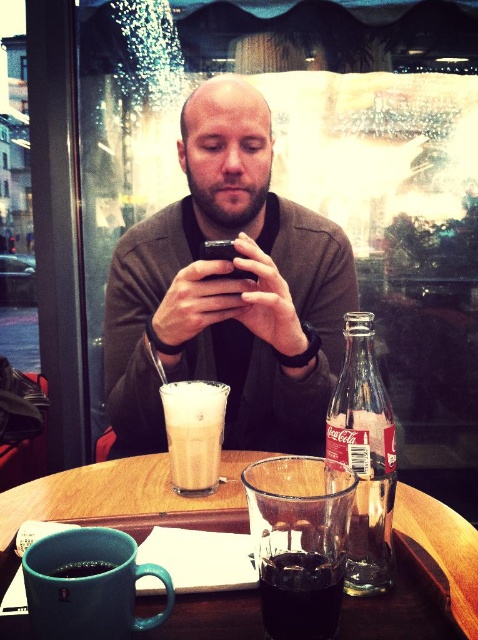
Describe the element at coordinates (228, 291) in the screenshot. The image size is (478, 640). I see `matte brown sweater at center` at that location.

Who is more forward, (315, 308) or (181, 452)?

Point (181, 452) is in front.

Does point (186, 332) come in front of point (201, 387)?

That is False.

The height and width of the screenshot is (640, 478). I want to click on matte brown sweater at center, so click(228, 291).

Find the location of a particular element. The image size is (478, 640). dark glass at center is located at coordinates (301, 595).

Between point (303, 627) and point (171, 396), which one is positioned in front?

Point (303, 627) is in front.

I want to click on dark glass at center, so click(301, 595).

Which is in front, point (381, 504) or point (111, 563)?

Point (111, 563) is more forward.

Find the location of a particular element. clear glass coca-cola bottle at right is located at coordinates (365, 456).